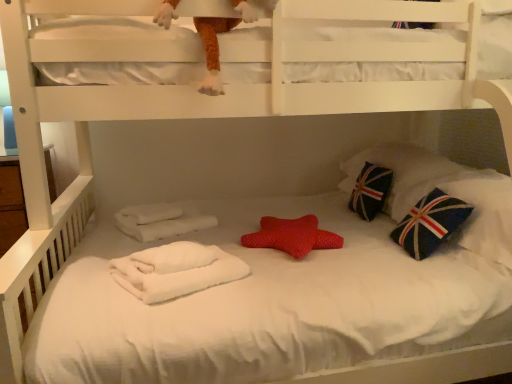
Question: Can you confirm if fuzzy orange plush at upper center is positioned to the right of rubber star at center?

Choices:
 (A) no
 (B) yes

Answer: (A)

Question: Does fuzzy orange plush at upper center have a lesser width compared to rubber star at center?

Choices:
 (A) no
 (B) yes

Answer: (B)

Question: Is fuzzy orange plush at upper center positioned behind rubber star at center?

Choices:
 (A) yes
 (B) no

Answer: (B)

Question: Does fuzzy orange plush at upper center have a greater height compared to rubber star at center?

Choices:
 (A) no
 (B) yes

Answer: (B)

Question: Does fuzzy orange plush at upper center have a greater width compared to rubber star at center?

Choices:
 (A) no
 (B) yes

Answer: (A)

Question: Are fuzzy orange plush at upper center and rubber star at center far apart?

Choices:
 (A) no
 (B) yes

Answer: (A)

Question: From the image's perspective, would you say fuzzy orange plush at upper center is shown under blue fabric pillow with union jack design at right, marked as the second pillow in a front-to-back arrangement?

Choices:
 (A) no
 (B) yes

Answer: (A)

Question: Is fuzzy orange plush at upper center to the right of blue fabric pillow with union jack design at right, marked as the second pillow in a front-to-back arrangement, from the viewer's perspective?

Choices:
 (A) yes
 (B) no

Answer: (B)

Question: Does fuzzy orange plush at upper center contain blue fabric pillow with union jack design at right, marked as the second pillow in a front-to-back arrangement?

Choices:
 (A) yes
 (B) no

Answer: (B)

Question: Does fuzzy orange plush at upper center have a greater width compared to blue fabric pillow with union jack design at right, marked as the second pillow in a front-to-back arrangement?

Choices:
 (A) yes
 (B) no

Answer: (B)

Question: Is fuzzy orange plush at upper center far away from blue fabric pillow with union jack design at right, positioned as the 1th pillow in back-to-front order?

Choices:
 (A) no
 (B) yes

Answer: (B)

Question: Is fuzzy orange plush at upper center directly adjacent to blue fabric pillow with union jack design at right, positioned as the 1th pillow in back-to-front order?

Choices:
 (A) yes
 (B) no

Answer: (B)

Question: Is dark blue fabric pillow with union jack design at right, which is counted as the 2th pillow, starting from the back, far away from rubber star at center?

Choices:
 (A) yes
 (B) no

Answer: (B)